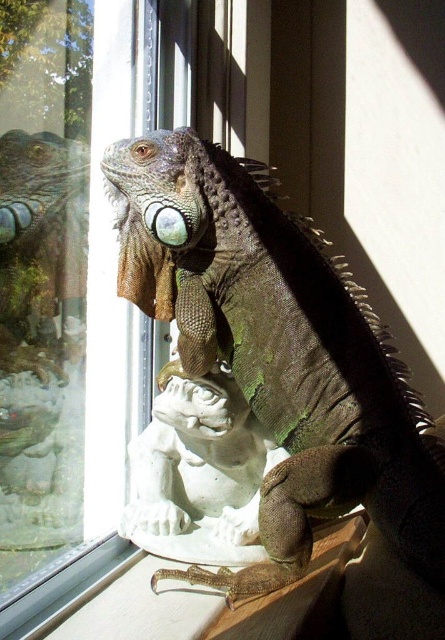
Find the location of a particular element. This screenshot has width=445, height=640. clear glass window at center is located at coordinates (77, 280).

Which is above, clear glass window at center or green scaly lizard at center?

clear glass window at center is higher up.

Between point (176, 60) and point (275, 273), which one is positioned in front?

Point (275, 273) is in front.

Where is `clear glass window at center`? Image resolution: width=445 pixels, height=640 pixels. clear glass window at center is located at coordinates (77, 280).